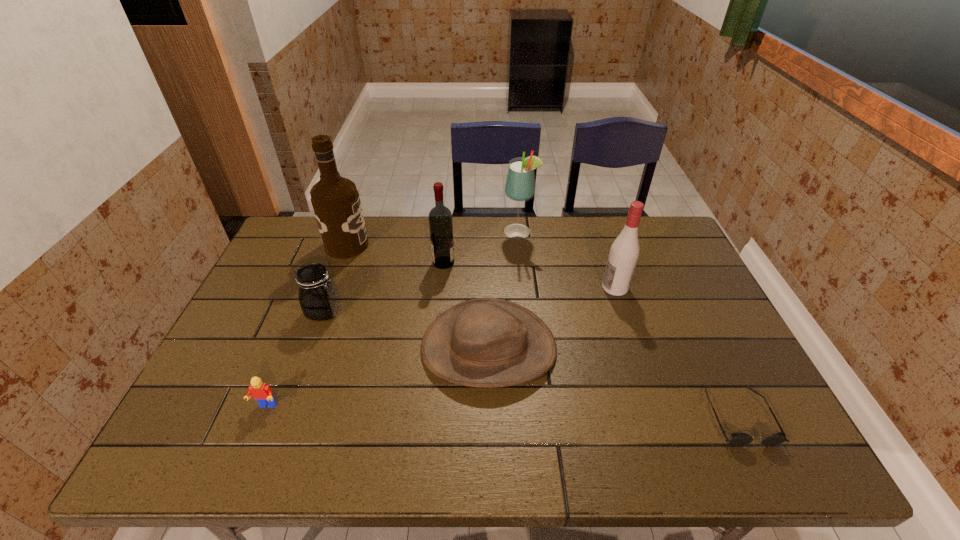
Find the location of `the leftmost alcohol`. the leftmost alcohol is located at coordinates (335, 200).

Locate an element on the screen. the second alcohol from right to left is located at coordinates (520, 183).

Locate an element on the screen. The image size is (960, 540). the rightmost alcohol is located at coordinates (624, 252).

Image resolution: width=960 pixels, height=540 pixels. I want to click on the seventh object from left to right, so click(x=624, y=252).

Locate an element on the screen. the second alcohol from left to right is located at coordinates (440, 218).

Locate an element on the screen. Image resolution: width=960 pixels, height=540 pixels. jar is located at coordinates (317, 294).

Locate an element on the screen. The width and height of the screenshot is (960, 540). cowboy hat is located at coordinates (488, 342).

Find the location of a particular element. This screenshot has width=960, height=540. Lego is located at coordinates (261, 392).

The image size is (960, 540). What are the coordinates of `the rightmost object` in the screenshot? It's located at (738, 439).

Find the location of a particular element. This screenshot has width=960, height=540. the shortest object is located at coordinates (738, 439).